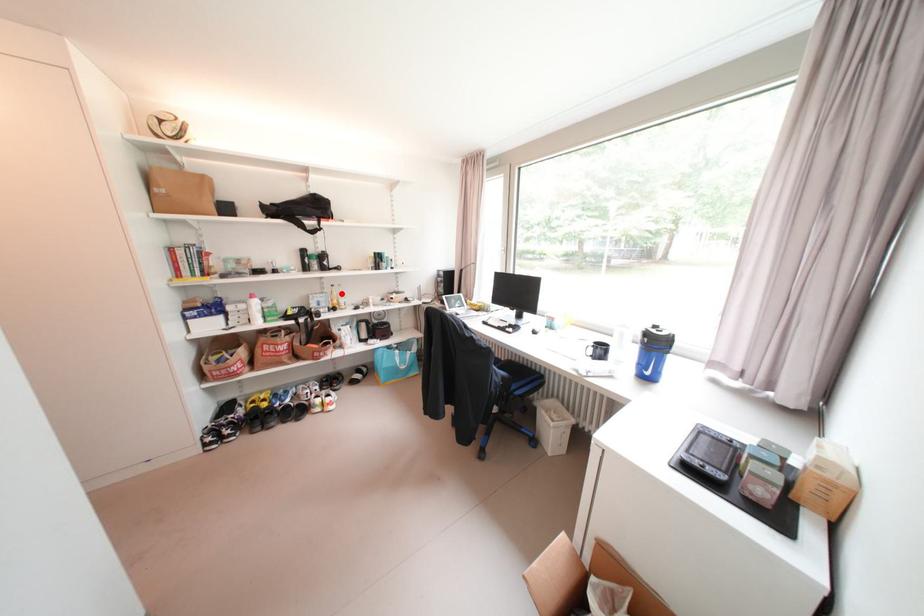
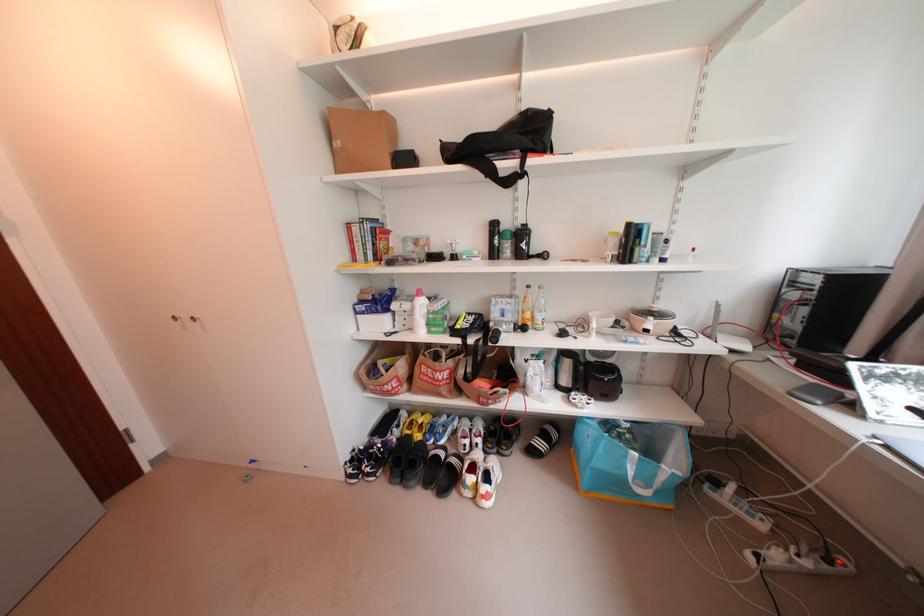
Find the pixel in the second image that matches the highlighted location in the first image.

(536, 301)